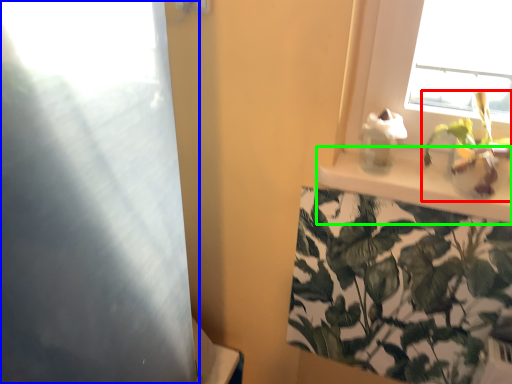
Question: Which is nearer to the houseplant (highlighted by a red box)? screen door (highlighted by a blue box) or window sill (highlighted by a green box).

Choices:
 (A) screen door
 (B) window sill

Answer: (B)